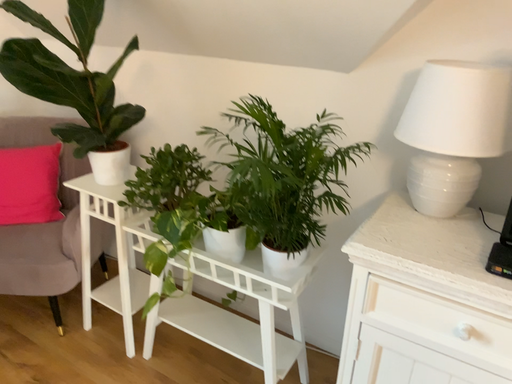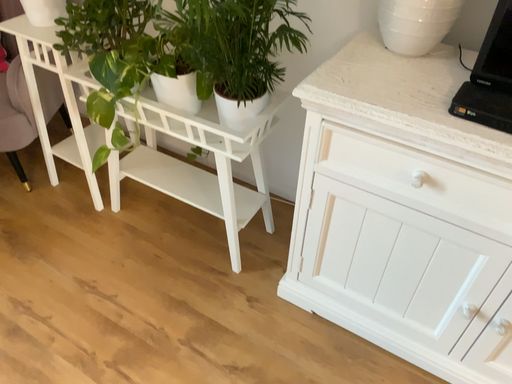
Question: How did the camera likely rotate when shooting the video?

Choices:
 (A) rotated upward
 (B) rotated downward

Answer: (B)